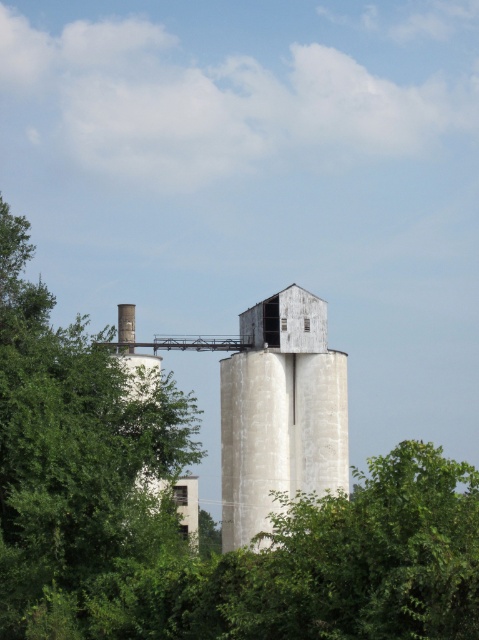
Question: Does green leafy tree at left appear on the left side of white matte water tower at center?

Choices:
 (A) no
 (B) yes

Answer: (B)

Question: Is green leafy tree at left closer to camera compared to white matte water tower at center?

Choices:
 (A) yes
 (B) no

Answer: (A)

Question: Which point appears closest to the camera in this image?

Choices:
 (A) (250, 502)
 (B) (42, 340)

Answer: (B)

Question: Can you confirm if green leafy tree at left is positioned to the left of white matte water tower at center?

Choices:
 (A) yes
 (B) no

Answer: (A)